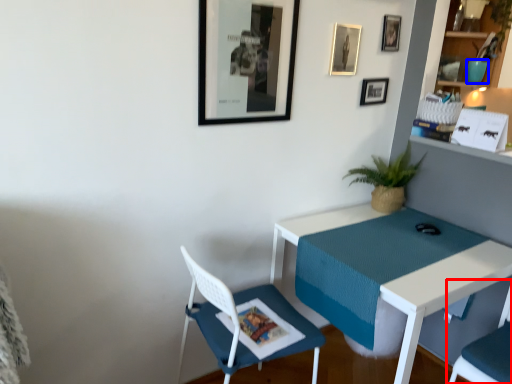
Question: Which of the following is the closest to the observer, chair (highlighted by a red box) or teal (highlighted by a blue box)?

Choices:
 (A) chair
 (B) teal

Answer: (A)